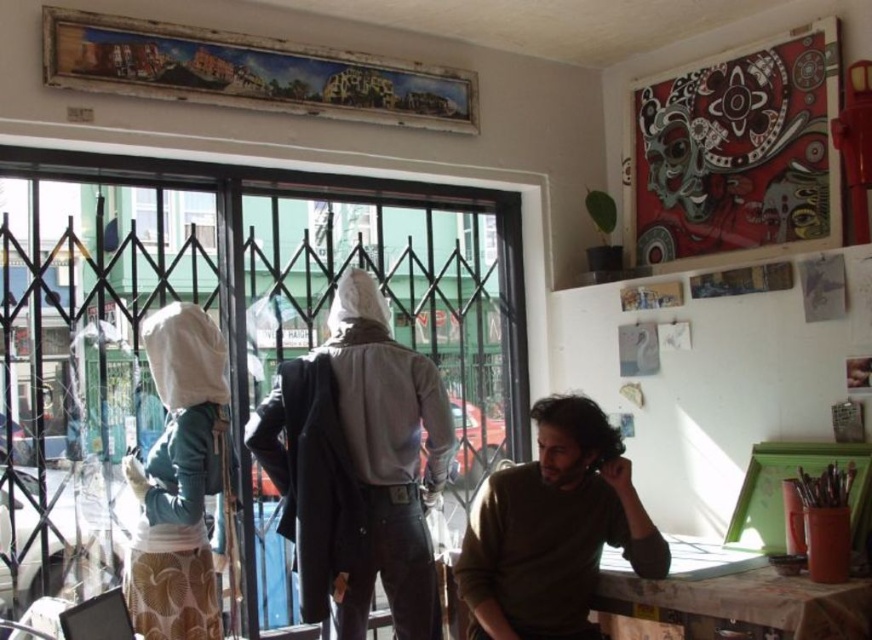
Is brown sweater at center wider than wooden table at lower right?

→ No, brown sweater at center is not wider than wooden table at lower right.

Which is in front, point (631, 506) or point (651, 586)?

Positioned in front is point (651, 586).

Between point (553, 460) and point (779, 632), which one is positioned in front?

Point (779, 632) is in front.

Image resolution: width=872 pixels, height=640 pixels. In order to click on brown sweater at center in this screenshot , I will do `click(553, 529)`.

Is brown sweater at center smaller than white fabric bag at left?

Yes, brown sweater at center is smaller than white fabric bag at left.

Does brown sweater at center appear on the left side of white fabric bag at left?

No, brown sweater at center is not to the left of white fabric bag at left.

Which is behind, point (545, 612) or point (169, 337)?

The point (169, 337) is behind.

Where is `brown sweater at center`? The height and width of the screenshot is (640, 872). brown sweater at center is located at coordinates (553, 529).

Consider the image. Measure the distance between clear glass door at left and brown sweater at center.

clear glass door at left is 38.71 inches away from brown sweater at center.

Can you confirm if clear glass door at left is wider than brown sweater at center?

Yes.

Is point (223, 440) positioned behind point (485, 608)?

Yes, it is.

The width and height of the screenshot is (872, 640). What are the coordinates of `clear glass door at left` in the screenshot? It's located at (227, 333).